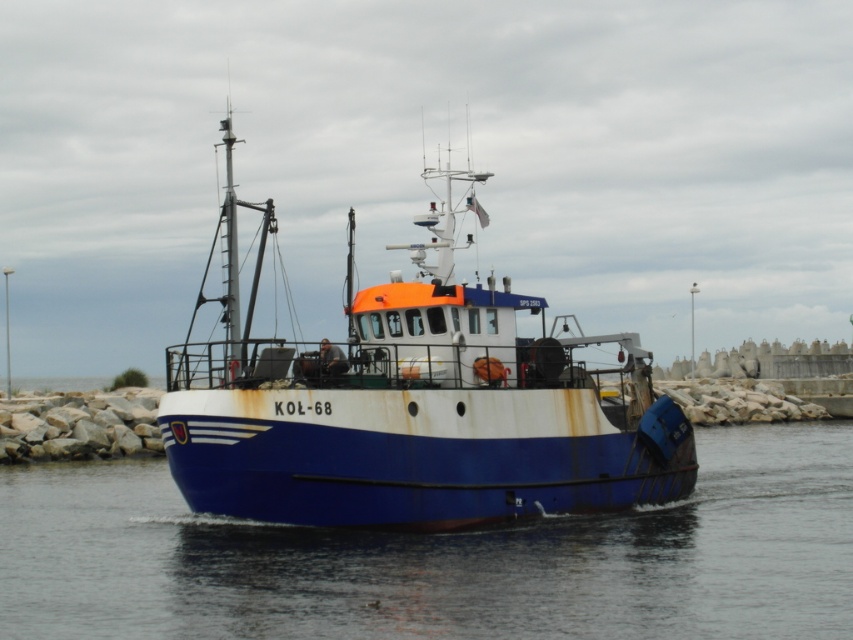
Can you confirm if blue smooth water at center is positioned to the right of rusty metal boat at center?

Indeed, blue smooth water at center is positioned on the right side of rusty metal boat at center.

Who is more distant from viewer, (x=309, y=598) or (x=305, y=444)?

Point (x=305, y=444)

What do you see at coordinates (442, 557) in the screenshot? I see `blue smooth water at center` at bounding box center [442, 557].

This screenshot has height=640, width=853. Find the location of `blue smooth water at center`. blue smooth water at center is located at coordinates (442, 557).